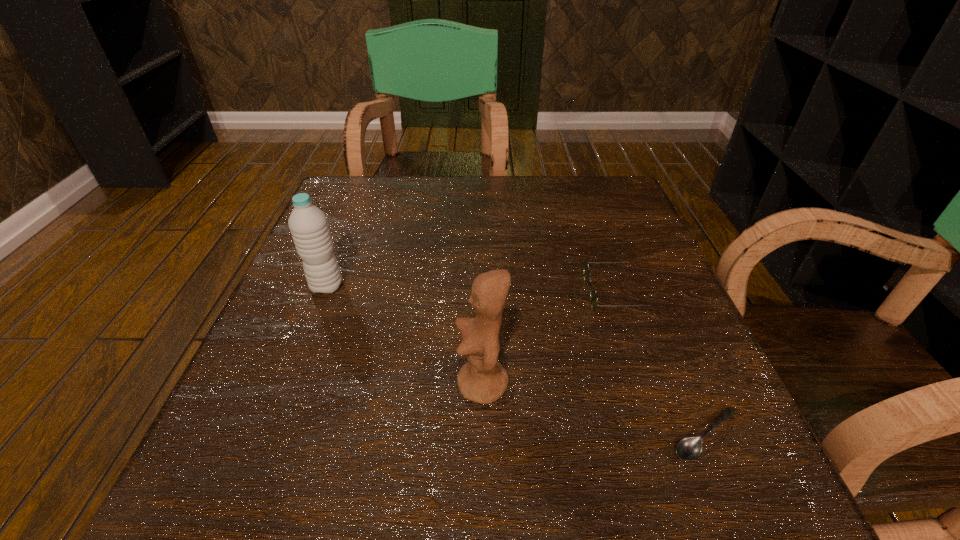
Find the location of `vacant space that is in between the second object from left to right and the sunglasses`. vacant space that is in between the second object from left to right and the sunglasses is located at coordinates (551, 339).

Locate which object is the closest to the third tallest object. Please provide its 2D coordinates. Your answer should be formatted as a tuple, i.e. [(x, y)], where the tuple contains the x and y coordinates of a point satisfying the conditions above.

[(690, 448)]

Point out which object is positioned as the third nearest to the figurine. Please provide its 2D coordinates. Your answer should be formatted as a tuple, i.e. [(x, y)], where the tuple contains the x and y coordinates of a point satisfying the conditions above.

[(308, 225)]

The image size is (960, 540). I want to click on vacant region that satisfies the following two spatial constraints: 1. on the front-facing side of the third tallest object; 2. on the right side of the shortest object, so click(x=668, y=435).

Identify the location of free space that satisfies the following two spatial constraints: 1. on the front-facing side of the shortest object; 2. on the right side of the figurine. This screenshot has height=540, width=960. (483, 435).

Where is `free spot that satisfies the following two spatial constraints: 1. on the front-facing side of the figurine; 2. on the right side of the soupspoon`? free spot that satisfies the following two spatial constraints: 1. on the front-facing side of the figurine; 2. on the right side of the soupspoon is located at coordinates (483, 435).

Where is `vacant space that satisfies the following two spatial constraints: 1. on the back side of the shortest object; 2. on the front-facing side of the figurine`? Image resolution: width=960 pixels, height=540 pixels. vacant space that satisfies the following two spatial constraints: 1. on the back side of the shortest object; 2. on the front-facing side of the figurine is located at coordinates (685, 384).

This screenshot has height=540, width=960. Find the location of `vacant space that satisfies the following two spatial constraints: 1. on the front-facing side of the soupspoon; 2. on the left side of the second shortest object`. vacant space that satisfies the following two spatial constraints: 1. on the front-facing side of the soupspoon; 2. on the left side of the second shortest object is located at coordinates (668, 435).

Locate an element on the screen. free location that satisfies the following two spatial constraints: 1. on the front-facing side of the shortest object; 2. on the left side of the sunglasses is located at coordinates (668, 435).

Identify the location of vacant area in the image that satisfies the following two spatial constraints: 1. on the front-facing side of the shortest object; 2. on the left side of the sunglasses. click(x=668, y=435).